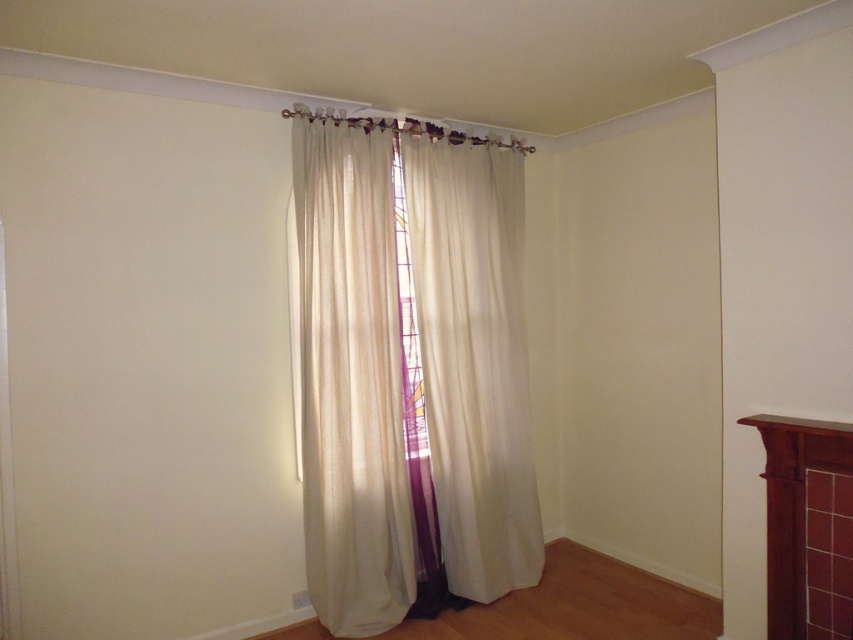
Between point (323, 136) and point (403, 220), which one is positioned behind?

The point (403, 220) is behind.

Between sheer white curtain at center and transparent glass window at center, which one appears on the right side from the viewer's perspective?

sheer white curtain at center is more to the right.

Between point (335, 280) and point (404, 205), which one is positioned in front?

Positioned in front is point (335, 280).

The image size is (853, 640). I want to click on sheer white curtain at center, so click(x=351, y=380).

Based on the photo, how distant is brown wood fireplace at right from transparent glass window at center?

They are 1.58 meters apart.

Does brown wood fireplace at right appear on the left side of transparent glass window at center?

In fact, brown wood fireplace at right is to the right of transparent glass window at center.

Between point (788, 456) and point (399, 161), which one is positioned behind?

Point (399, 161)

Locate an element on the screen. The width and height of the screenshot is (853, 640). brown wood fireplace at right is located at coordinates (793, 506).

Between sheer white curtain at center and brown wood fireplace at right, which one appears on the right side from the viewer's perspective?

Positioned to the right is brown wood fireplace at right.

Is sheer white curtain at center taller than brown wood fireplace at right?

Yes.

Where is `sheer white curtain at center`? sheer white curtain at center is located at coordinates (351, 380).